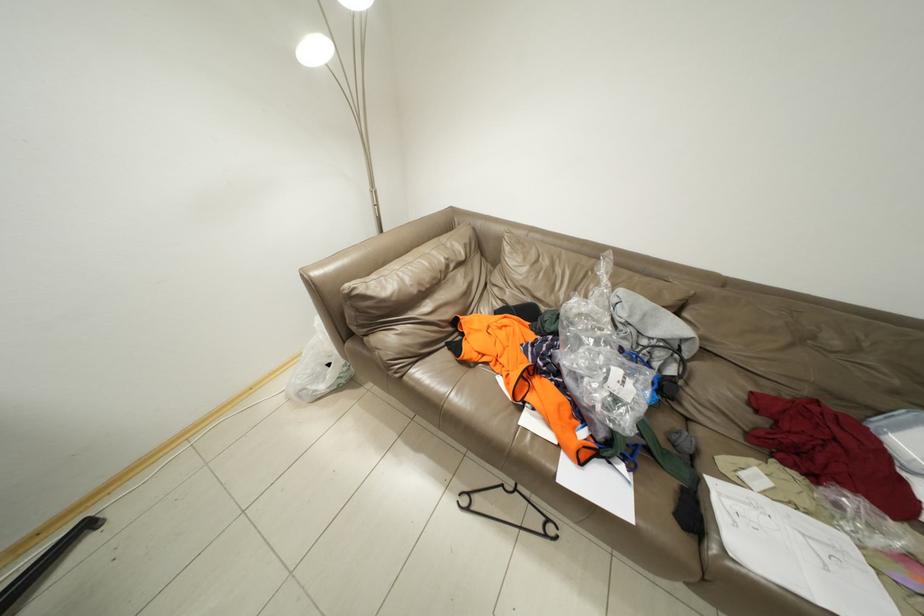
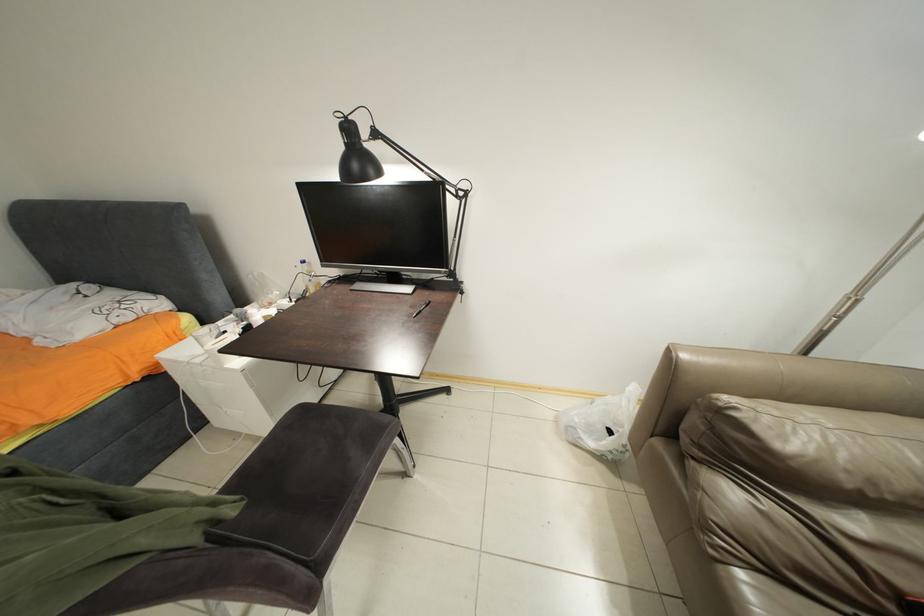
Question: The camera is either moving clockwise (left) or counter-clockwise (right) around the object. The first image is from the beginning of the video and the second image is from the end. Is the camera moving left or right when shooting the video?

Choices:
 (A) Left
 (B) Right

Answer: (B)